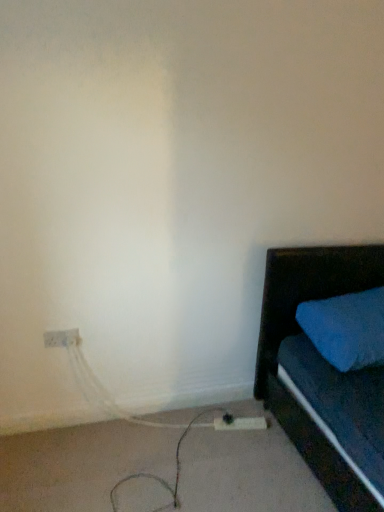
Question: From a real-world perspective, is white plastic extension cord at lower center positioned above or below white plastic electric outlet at lower left?

Choices:
 (A) below
 (B) above

Answer: (A)

Question: From the image's perspective, relative to white plastic electric outlet at lower left, is white plastic extension cord at lower center above or below?

Choices:
 (A) above
 (B) below

Answer: (B)

Question: Which of these objects is positioned closest to the white plastic electric outlet at lower left?

Choices:
 (A) white plastic extension cord at lower center
 (B) white matte cable at lower left

Answer: (B)

Question: Estimate the real-world distances between objects in this image. Which object is farther from the white matte cable at lower left?

Choices:
 (A) white plastic extension cord at lower center
 (B) white plastic electric outlet at lower left

Answer: (B)